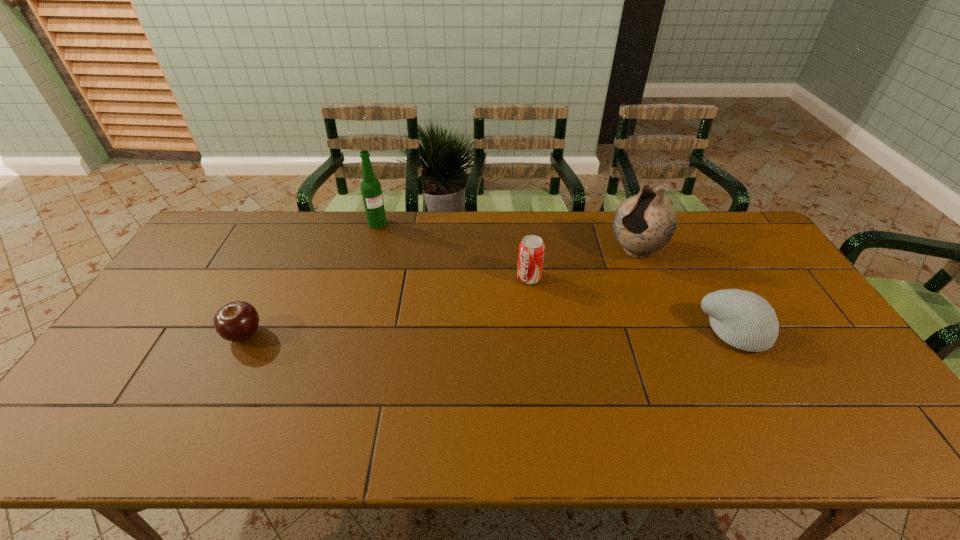
Locate an element on the screen. This screenshot has width=960, height=540. the leftmost object is located at coordinates (237, 321).

Find the location of `beanie`. beanie is located at coordinates (743, 319).

The image size is (960, 540). Find the location of `the fourth nearest object`. the fourth nearest object is located at coordinates (644, 223).

Find the location of a particular element. The width and height of the screenshot is (960, 540). soda can is located at coordinates point(531,249).

Locate an element on the screen. The image size is (960, 540). the third object from right to left is located at coordinates click(531, 249).

Locate an element on the screen. beer bottle is located at coordinates (371, 190).

Find the location of `the farthest object`. the farthest object is located at coordinates (371, 190).

Locate an element on the screen. The height and width of the screenshot is (540, 960). vacant space located on the back of the leftmost object is located at coordinates coord(274,276).

Where is `vacant space located 0.390m on the left of the beanie`? The image size is (960, 540). vacant space located 0.390m on the left of the beanie is located at coordinates (560, 332).

This screenshot has width=960, height=540. In order to click on free space located 0.140m from the spout of the pottery in this screenshot , I will do `click(592, 284)`.